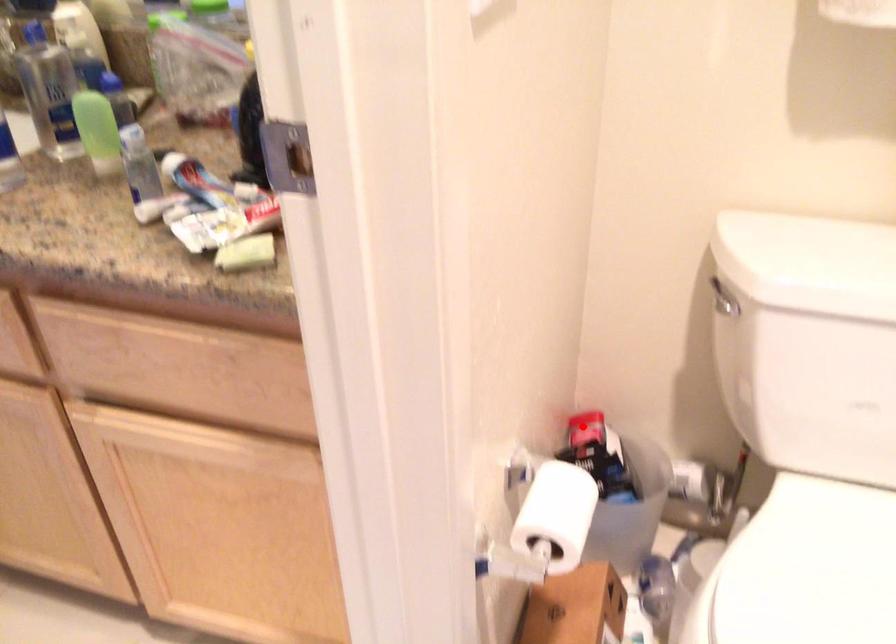
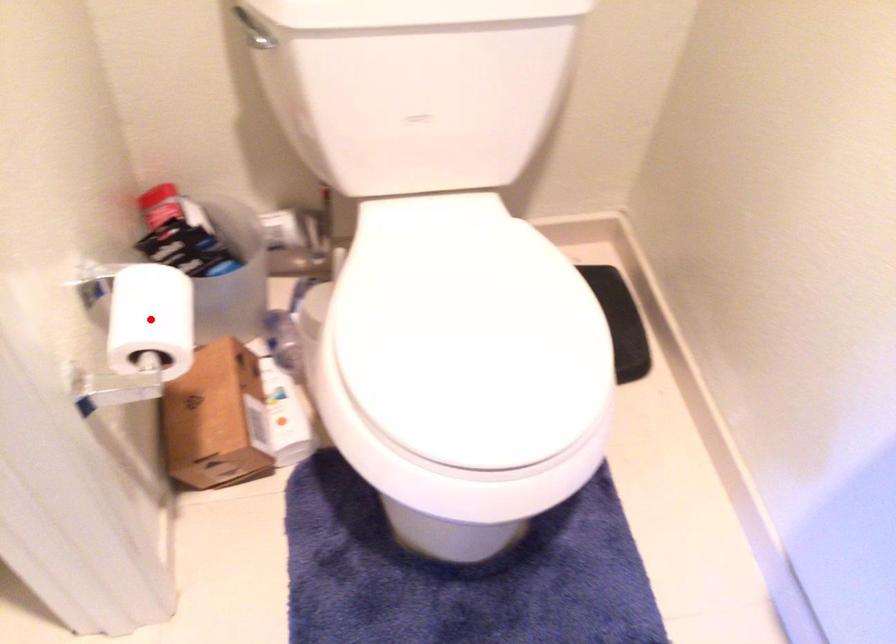
Looking at this image, I am providing you with two images of the same scene from different viewpoints. A red point is marked on the first image and another point is marked on the second image. Is the red point in image1 aligned with the point shown in image2?

No